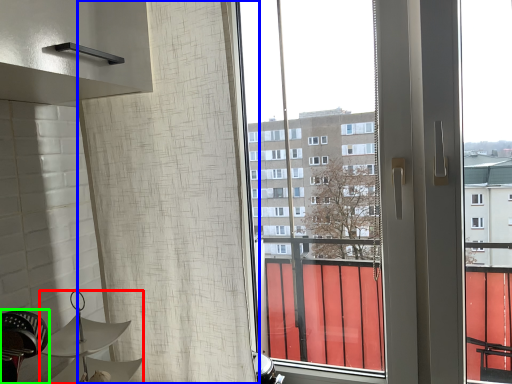
Question: Which object is positioned farthest from lamp (highlighted by a red box)? Select from shower curtain (highlighted by a blue box) and swivel chair (highlighted by a green box).

Choices:
 (A) shower curtain
 (B) swivel chair

Answer: (A)